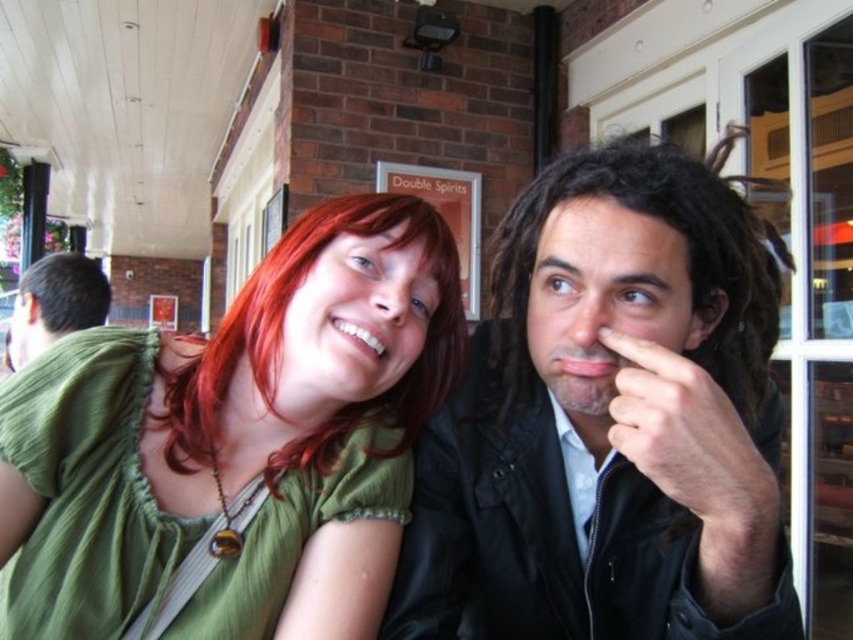
Which is more to the right, dark brown curly hair at right or shiny red hair at center?

Positioned to the right is dark brown curly hair at right.

Measure the distance from dark brown curly hair at right to shiny red hair at center.

dark brown curly hair at right is 19.76 centimeters from shiny red hair at center.

Does point (715, 170) come behind point (427, 248)?

Yes.

At what (x,y) coordinates should I click in order to perform the action: click on dark brown curly hair at right. Please return your answer as a coordinate pair (x, y). The height and width of the screenshot is (640, 853). Looking at the image, I should click on (688, 259).

Is matte black jacket at center above dark brown curly hair at right?

No.

Which is behind, point (491, 456) or point (721, 148)?

The point (721, 148) is behind.

Image resolution: width=853 pixels, height=640 pixels. Identify the location of matte black jacket at center. (608, 422).

Is point (274, 410) more distant than point (18, 358)?

That is False.

Does green fabric shirt at center have a larger size compared to green fabric shirt at left?

Actually, green fabric shirt at center might be smaller than green fabric shirt at left.

This screenshot has width=853, height=640. What do you see at coordinates (235, 444) in the screenshot?
I see `green fabric shirt at center` at bounding box center [235, 444].

In order to click on green fabric shirt at center in this screenshot , I will do `click(235, 444)`.